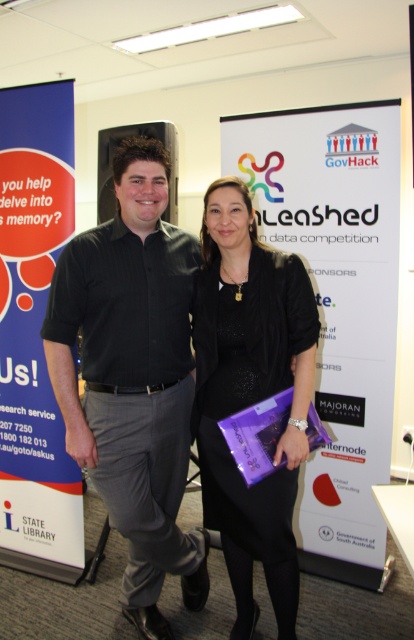
From the picture: Where is the black glossy shirt at left located in the image?

The black glossy shirt at left is located at point 0.591 on the x axis and 0.321 on the y axis.

You are organizing a photo shoot and need to ensure that the black glossy shirt at left and the black satin dress at center are visible in the frame. Given that the camera has a fixed focal length and the current composition shows both items, which object would require less horizontal space adjustment to keep centered if the camera slightly shifts to the right?

The black satin dress at center requires less horizontal space adjustment to stay centered because its width is narrower than the black glossy shirt at left, which is wider. Since the dress is narrower, it can tolerate more movement without losing centering compared to the wider shirt.